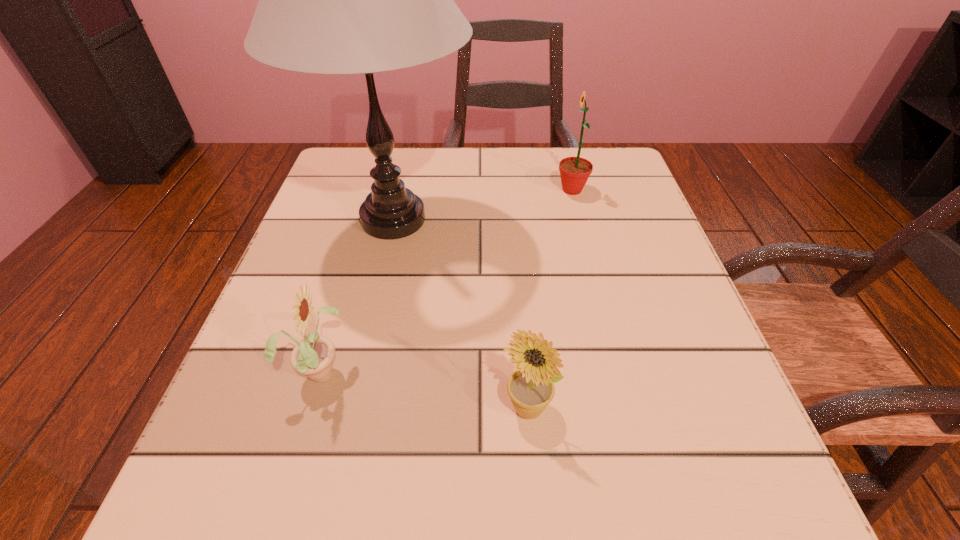
Identify the location of lamp present at the far edge. (331, 0).

Image resolution: width=960 pixels, height=540 pixels. In order to click on sunflower that is at the far edge in this screenshot , I will do `click(574, 171)`.

This screenshot has width=960, height=540. What are the coordinates of `lamp present at the left edge` in the screenshot? It's located at (331, 0).

This screenshot has height=540, width=960. Find the location of `sunflower present at the left edge`. sunflower present at the left edge is located at coordinates (313, 356).

Find the location of a particular element. The width and height of the screenshot is (960, 540). object present at the right edge is located at coordinates (574, 171).

You are a GUI agent. You are given a task and a screenshot of the screen. Output one action in this format:
    pyautogui.click(x=<x>, y=<y>)
    Task: Click on the object that is at the far left corner
    The height and width of the screenshot is (540, 960).
    Given the screenshot: What is the action you would take?
    pyautogui.click(x=331, y=0)

You are a GUI agent. You are given a task and a screenshot of the screen. Output one action in this format:
    pyautogui.click(x=<x>, y=<y>)
    Task: Click on the object that is at the far right corner
    
    Given the screenshot: What is the action you would take?
    pyautogui.click(x=574, y=171)

Locate an element on the screen. This screenshot has height=540, width=960. free region at the far edge of the desktop is located at coordinates (493, 148).

Identify the location of free space at the near edge. (411, 453).

The image size is (960, 540). In the image, there is a desktop. Find the location of `vacant region at the left edge`. vacant region at the left edge is located at coordinates (291, 275).